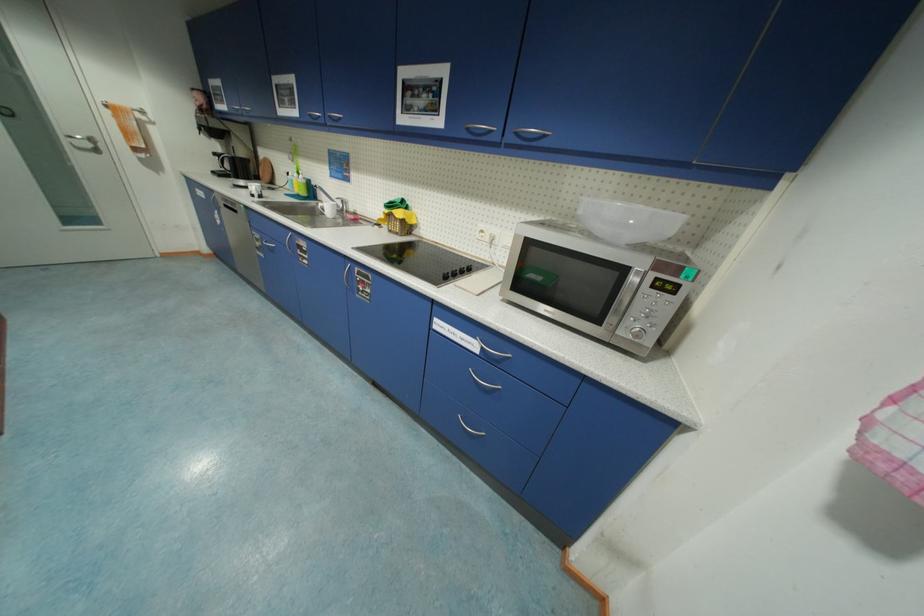
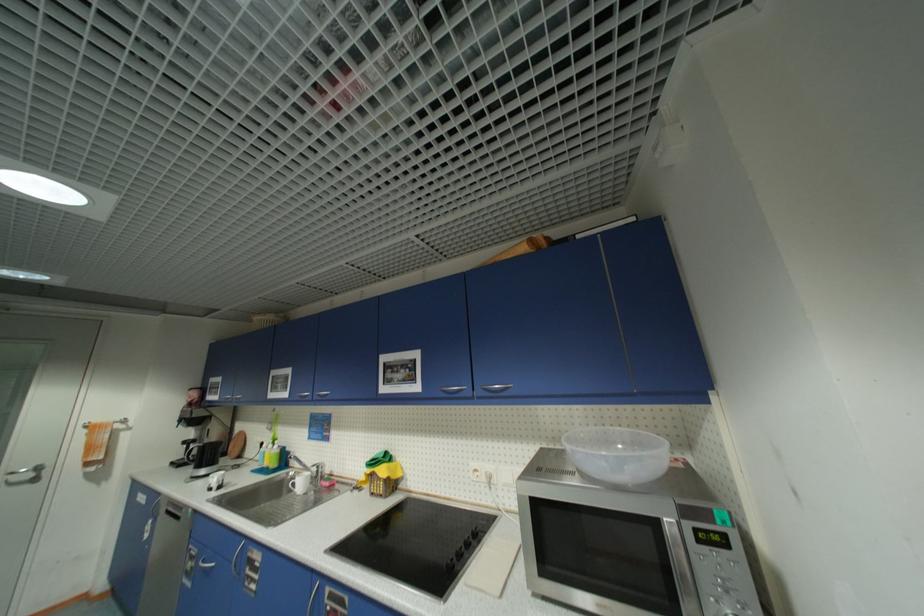
Question: I am providing you with two images of the same scene from different viewpoints. After the viewpoint changes to image2, which objects are now occluded?

Choices:
 (A) clear plastic bowl
 (B) silver cabinet handle
 (C) small yellow basket
 (D) none of these

Answer: (D)